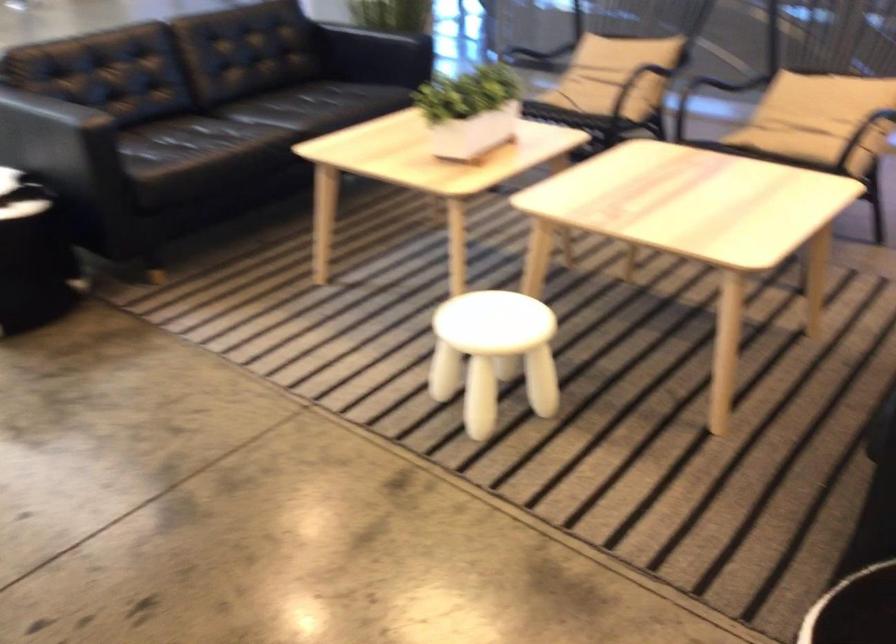
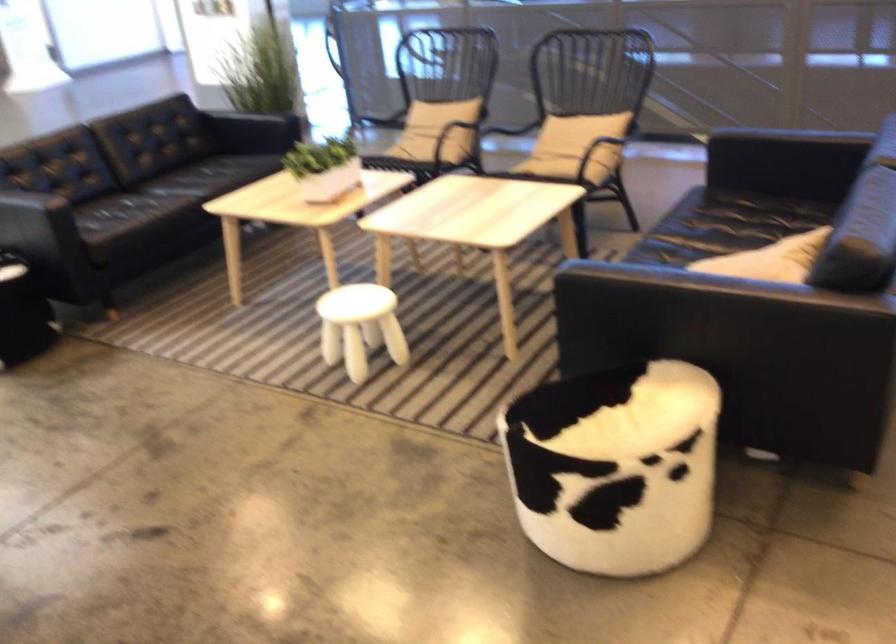
The point at (470, 113) is marked in the first image. Where is the corresponding point in the second image?

(323, 167)